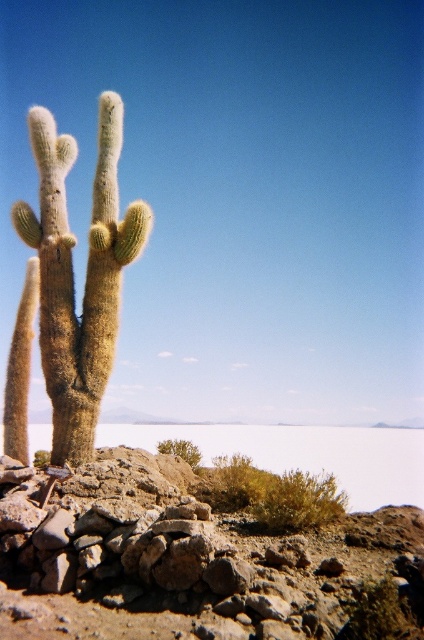
Which is behind, point (116, 449) or point (345, 435)?

The point (345, 435) is more distant.

Can you confirm if rusty stone boulder at center is thinner than brown rocky plain at lower center?

Indeed, rusty stone boulder at center has a lesser width compared to brown rocky plain at lower center.

Find the location of a particular element. rusty stone boulder at center is located at coordinates (195, 561).

Can you confirm if rusty stone boulder at center is positioned to the right of green fuzzy cactus at left?

Correct, you'll find rusty stone boulder at center to the right of green fuzzy cactus at left.

Between rusty stone boulder at center and green fuzzy cactus at left, which one is positioned lower?

rusty stone boulder at center is lower down.

Does point (192, 499) lie behind point (86, 298)?

No.

What are the coordinates of `rusty stone boulder at center` in the screenshot? It's located at (195, 561).

Who is more forward, (97, 253) or (292, 465)?

Point (97, 253) is more forward.

Which is below, green fuzzy cactus at left or brown rocky plain at lower center?

brown rocky plain at lower center is below.

Is point (66, 273) more distant than point (353, 467)?

No, (66, 273) is closer to viewer.

Locate an element on the screen. green fuzzy cactus at left is located at coordinates (72, 276).